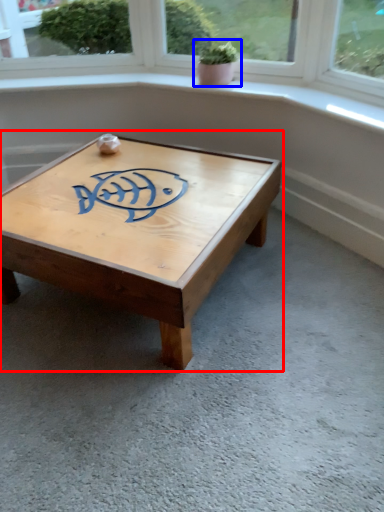
Question: Which point is closer to the camera, coffee table (highlighted by a red box) or houseplant (highlighted by a blue box)?

Choices:
 (A) coffee table
 (B) houseplant

Answer: (A)